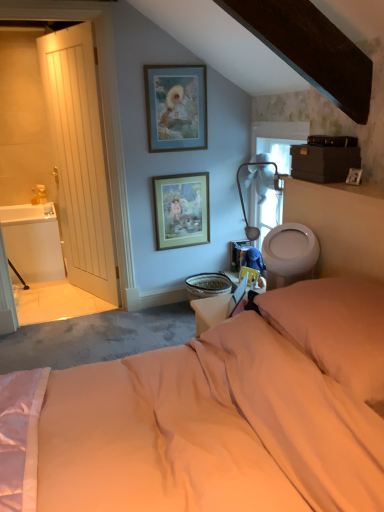
Find the location of a particular element. vacant space that is to the left of white wooden door at left is located at coordinates (55, 298).